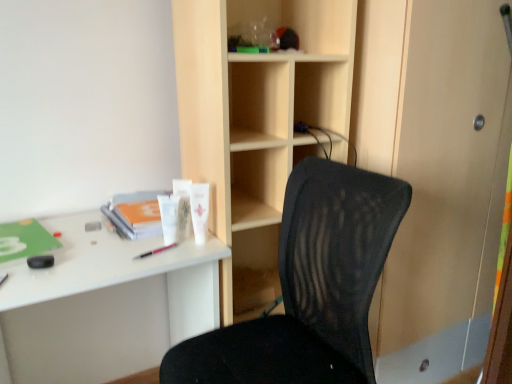
In order to face white plastic desk at left, should I rotate leftwards or rightwards?

It's best to rotate left around 19.765 degrees.

Where is `wooden at center`? The height and width of the screenshot is (384, 512). wooden at center is located at coordinates (258, 121).

Find the location of a particular element. This screenshot has width=512, height=384. pink plastic pen at center, acting as the 2th stationery starting from the right is located at coordinates (155, 251).

This screenshot has height=384, width=512. What do you see at coordinates (447, 190) in the screenshot?
I see `transparent glass screen door at right` at bounding box center [447, 190].

At what (x,y) coordinates should I click in order to perform the action: click on white matte lotion at center, arranged as the 2th stationery when ordered from the bottom. Please return your answer as a coordinate pair (x, y). The image size is (512, 384). Looking at the image, I should click on (199, 210).

Is wooden at center spatially inside black mesh chair at center, or outside of it?

wooden at center exists outside the volume of black mesh chair at center.

Between wooden at center and black mesh chair at center, which one has larger width?

With larger width is black mesh chair at center.

Is point (324, 120) closer to viewer compared to point (298, 165)?

No.

Is wooden at center facing away from black mesh chair at center?

That's not correct — wooden at center is not looking away from black mesh chair at center.

Which is in front, point (282, 120) or point (205, 195)?

The point (205, 195) is more forward.

From a real-world perspective, is wooden at center under white matte lotion at center, placed as the 2th stationery when sorted from left to right?

Indeed, from a real-world perspective, wooden at center is positioned beneath white matte lotion at center, placed as the 2th stationery when sorted from left to right.

Is wooden at center looking in the opposite direction of white matte lotion at center, arranged as the 2th stationery when ordered from the bottom?

No, white matte lotion at center, arranged as the 2th stationery when ordered from the bottom, is not at the back of wooden at center.

Consider the image. Which object is positioned more to the left, wooden at center or white matte lotion at center, placed as the 2th stationery when sorted from left to right?

white matte lotion at center, placed as the 2th stationery when sorted from left to right, is more to the left.

Is the position of black mesh chair at center less distant than that of pink plastic pen at center, which ranks as the first stationery in bottom-to-top order?

Yes.

Between black mesh chair at center and pink plastic pen at center, acting as the 2th stationery starting from the right, which one has less height?

With less height is pink plastic pen at center, acting as the 2th stationery starting from the right.

From a real-world perspective, is black mesh chair at center above or below pink plastic pen at center, the second stationery in the top-to-bottom sequence?

From a real-world perspective, black mesh chair at center is physically below pink plastic pen at center, the second stationery in the top-to-bottom sequence.

Is point (360, 300) closer to camera compared to point (158, 252)?

Yes, it is.

From the image's perspective, would you say white matte lotion at center, which is counted as the first stationery, starting from the top, is positioned over wooden at center?

Incorrect, from the image's perspective, white matte lotion at center, which is counted as the first stationery, starting from the top, is lower than wooden at center.

From a real-world perspective, is white matte lotion at center, which is counted as the first stationery, starting from the top, physically below wooden at center?

No, from a real-world perspective, white matte lotion at center, which is counted as the first stationery, starting from the top, is not below wooden at center.

From their relative heights in the image, would you say white matte lotion at center, placed as the 2th stationery when sorted from left to right, is taller or shorter than wooden at center?

Considering their sizes, white matte lotion at center, placed as the 2th stationery when sorted from left to right, has less height than wooden at center.

From a real-world perspective, is white matte lotion at center, arranged as the 2th stationery when ordered from the bottom, physically above pink plastic pen at center, which ranks as the first stationery in bottom-to-top order?

Yes, from a real-world perspective, white matte lotion at center, arranged as the 2th stationery when ordered from the bottom, is above pink plastic pen at center, which ranks as the first stationery in bottom-to-top order.

Could you tell me if white matte lotion at center, placed as the 2th stationery when sorted from left to right, is turned towards pink plastic pen at center, the second stationery in the top-to-bottom sequence?

No, white matte lotion at center, placed as the 2th stationery when sorted from left to right, is not facing towards pink plastic pen at center, the second stationery in the top-to-bottom sequence.

Looking at the image, does white matte lotion at center, which is counted as the first stationery, starting from the top, seem bigger or smaller compared to pink plastic pen at center, the second stationery in the top-to-bottom sequence?

white matte lotion at center, which is counted as the first stationery, starting from the top, is bigger than pink plastic pen at center, the second stationery in the top-to-bottom sequence.

Does white plastic desk at left come behind white matte lotion at center, arranged as the 2th stationery when ordered from the bottom?

No, white plastic desk at left is in front of white matte lotion at center, arranged as the 2th stationery when ordered from the bottom.

Is white plastic desk at left next to white matte lotion at center, which is counted as the first stationery, starting from the top, and touching it?

No.

Is white plastic desk at left not inside white matte lotion at center, the first stationery positioned from the right?

white plastic desk at left is positioned outside white matte lotion at center, the first stationery positioned from the right.

Is white plastic desk at left wider than white matte lotion at center, placed as the 2th stationery when sorted from left to right?

Yes, white plastic desk at left is wider than white matte lotion at center, placed as the 2th stationery when sorted from left to right.

Considering the sizes of objects transparent glass screen door at right and black mesh chair at center in the image provided, who is taller, transparent glass screen door at right or black mesh chair at center?

transparent glass screen door at right is taller.

Image resolution: width=512 pixels, height=384 pixels. Identify the location of chair located below the transparent glass screen door at right (from the image's perspective). (310, 287).

Is transparent glass screen door at right beside black mesh chair at center?

No, transparent glass screen door at right is not making contact with black mesh chair at center.

Find the location of `shelf above the black mesh chair at center (from a real-world perspective)`. shelf above the black mesh chair at center (from a real-world perspective) is located at coordinates (258, 121).

The height and width of the screenshot is (384, 512). In order to click on shelf below the white matte lotion at center, placed as the 2th stationery when sorted from left to right (from a real-world perspective) in this screenshot , I will do `click(258, 121)`.

Estimate the real-world distances between objects in this image. Which object is closer to wooden at center, white matte lotion at center, placed as the 2th stationery when sorted from left to right, or black mesh chair at center?

The object closer to wooden at center is black mesh chair at center.

Estimate the real-world distances between objects in this image. Which object is closer to pink plastic pen at center, acting as the 2th stationery starting from the right, wooden at center or black mesh chair at center?

Based on the image, black mesh chair at center appears to be nearer to pink plastic pen at center, acting as the 2th stationery starting from the right.

Considering their positions, is white plastic desk at left positioned closer to transparent glass screen door at right than black mesh chair at center?

Based on the image, black mesh chair at center appears to be nearer to transparent glass screen door at right.

Considering their positions, is pink plastic pen at center, acting as the 2th stationery starting from the right, positioned closer to transparent glass screen door at right than black mesh chair at center?

Based on the image, black mesh chair at center appears to be nearer to transparent glass screen door at right.

Based on their spatial positions, is wooden at center or white plastic desk at left further from white matte lotion at center, which is counted as the first stationery, starting from the top?

white plastic desk at left is further to white matte lotion at center, which is counted as the first stationery, starting from the top.

Which object lies further to the anchor point pink plastic pen at center, which ranks as the first stationery in bottom-to-top order, wooden at center or transparent glass screen door at right?

The object further to pink plastic pen at center, which ranks as the first stationery in bottom-to-top order, is transparent glass screen door at right.

Looking at the image, which one is located closer to pink plastic pen at center, the second stationery in the top-to-bottom sequence, transparent glass screen door at right or white matte lotion at center, placed as the 2th stationery when sorted from left to right?

The object closer to pink plastic pen at center, the second stationery in the top-to-bottom sequence, is white matte lotion at center, placed as the 2th stationery when sorted from left to right.

When comparing their distances from transparent glass screen door at right, does black mesh chair at center or white matte lotion at center, arranged as the 2th stationery when ordered from the bottom, seem further?

Based on the image, white matte lotion at center, arranged as the 2th stationery when ordered from the bottom, appears to be further to transparent glass screen door at right.

Identify the location of stationery located between black mesh chair at center and white matte lotion at center, arranged as the 2th stationery when ordered from the bottom, in the depth direction. (155, 251).

Where is `chair located between white plastic desk at left and transparent glass screen door at right in the left-right direction`? The width and height of the screenshot is (512, 384). chair located between white plastic desk at left and transparent glass screen door at right in the left-right direction is located at coordinates click(x=310, y=287).

Find the location of a particular element. The width and height of the screenshot is (512, 384). shelf between black mesh chair at center and white matte lotion at center, which is counted as the first stationery, starting from the top, along the z-axis is located at coordinates (258, 121).

This screenshot has height=384, width=512. Find the location of `chair located between pink plastic pen at center, acting as the 2th stationery starting from the right, and transparent glass screen door at right in the left-right direction`. chair located between pink plastic pen at center, acting as the 2th stationery starting from the right, and transparent glass screen door at right in the left-right direction is located at coordinates (310, 287).